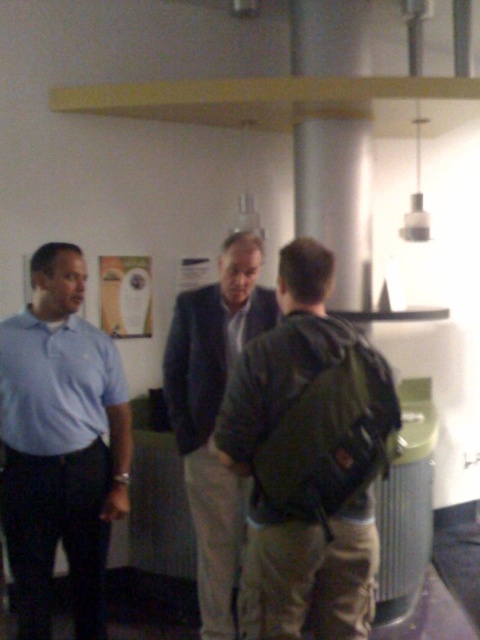
Who is higher up, light blue cotton shirt at left or dark blue suit at center?

dark blue suit at center is higher up.

Does light blue cotton shirt at left have a larger size compared to dark blue suit at center?

No.

Find the location of a particular element. Image resolution: width=480 pixels, height=640 pixels. light blue cotton shirt at left is located at coordinates (60, 444).

Does point (264, 609) lie behind point (100, 360)?

No, it is not.

Between green fabric backpack at center and light blue cotton shirt at left, which one has less height?

green fabric backpack at center is shorter.

You are a GUI agent. You are given a task and a screenshot of the screen. Output one action in this format:
    pyautogui.click(x=<x>, y=<y>)
    Task: Click on the green fabric backpack at center
    
    Given the screenshot: What is the action you would take?
    pyautogui.click(x=309, y=460)

Between green fabric backpack at center and dark blue suit at center, which one is positioned higher?

green fabric backpack at center is higher up.

Can you confirm if green fabric backpack at center is shorter than dark blue suit at center?

Indeed, green fabric backpack at center has a lesser height compared to dark blue suit at center.

Locate an element on the screen. green fabric backpack at center is located at coordinates (309, 460).